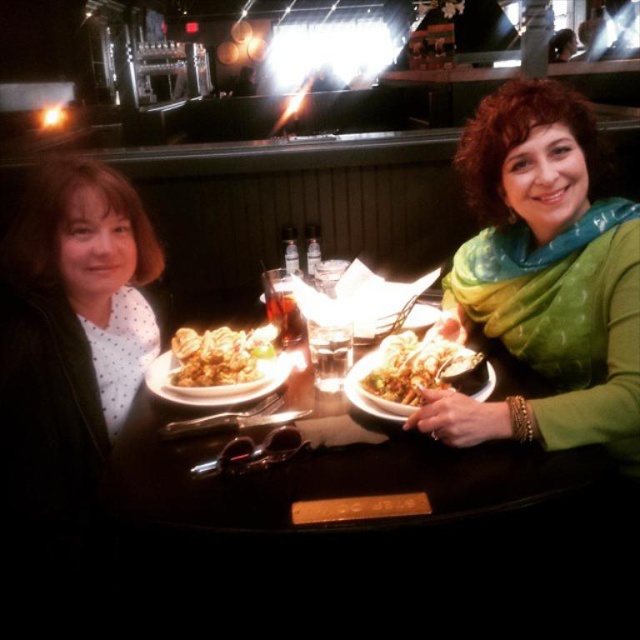
Question: Is green silk scarf at upper right positioned behind wooden table at center?

Choices:
 (A) yes
 (B) no

Answer: (A)

Question: In this image, where is green silk scarf at upper right located relative to golden crispy chicken at center?

Choices:
 (A) above
 (B) below

Answer: (A)

Question: Which point is closer to the camera?

Choices:
 (A) (227, 387)
 (B) (397, 412)
 (C) (524, 451)
 (D) (237, 355)

Answer: (C)

Question: Among these points, which one is farthest from the camera?

Choices:
 (A) (205, 380)
 (B) (268, 358)
 (C) (508, 244)

Answer: (C)

Question: Is golden crispy noodles at center to the left of golden crispy chicken at center from the viewer's perspective?

Choices:
 (A) yes
 (B) no

Answer: (B)

Question: Which object is positioned farthest from the wooden table at center?

Choices:
 (A) golden textured pasta at center
 (B) golden crispy chicken at center

Answer: (B)